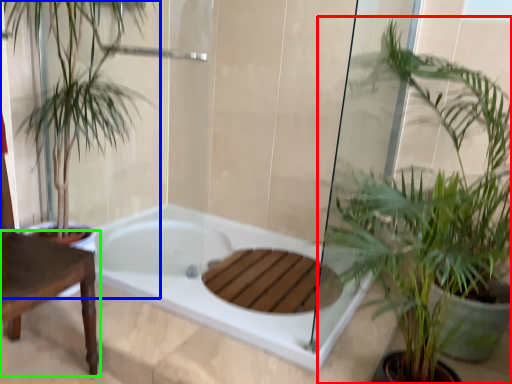
Question: Considering the real-world distances, which object is closest to houseplant (highlighted by a red box)? houseplant (highlighted by a blue box) or table (highlighted by a green box).

Choices:
 (A) houseplant
 (B) table

Answer: (B)